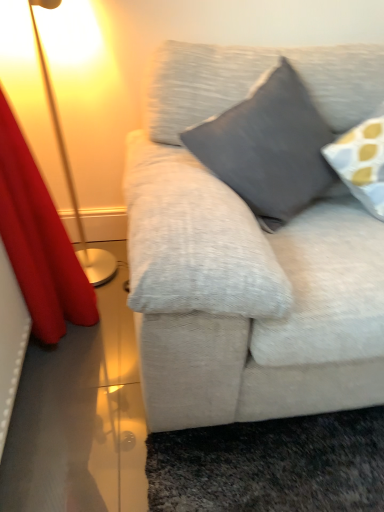
What is the approximate width of red velvet curtain at left?

The width of red velvet curtain at left is 10.45 inches.

Identify the location of dark gray fabric pillow at center. Image resolution: width=384 pixels, height=512 pixels. tap(269, 148).

What is the approximate height of dark gray fabric pillow at center?

The height of dark gray fabric pillow at center is 44.89 centimeters.

This screenshot has width=384, height=512. What do you see at coordinates (71, 172) in the screenshot?
I see `metallic gold lamp at left` at bounding box center [71, 172].

This screenshot has height=512, width=384. I want to click on red velvet curtain at left, so click(39, 241).

Based on the photo, from the image's perspective, is dark gray fabric pillow at center located above or below metallic gold lamp at left?

From the image's perspective, dark gray fabric pillow at center appears below metallic gold lamp at left.

Which is more distant, (x=262, y=118) or (x=36, y=25)?

The point (x=36, y=25) is farther from the camera.

This screenshot has height=512, width=384. In order to click on lamp on the left of dark gray fabric pillow at center in this screenshot , I will do `click(71, 172)`.

Which of these two, dark gray fabric pillow at center or metallic gold lamp at left, is smaller?

Smaller between the two is dark gray fabric pillow at center.

Between red velvet curtain at left and dark gray fabric pillow at center, which one has smaller width?

Thinner between the two is red velvet curtain at left.

Is red velvet curtain at left in front of or behind dark gray fabric pillow at center in the image?

red velvet curtain at left is in front of dark gray fabric pillow at center.

Considering the relative sizes of red velvet curtain at left and dark gray fabric pillow at center in the image provided, is red velvet curtain at left shorter than dark gray fabric pillow at center?

Incorrect, the height of red velvet curtain at left does not fall short of that of dark gray fabric pillow at center.

Does point (7, 206) appear closer or farther from the camera than point (252, 178)?

Clearly, point (7, 206) is closer to the camera than point (252, 178).

Considering the relative sizes of metallic gold lamp at left and red velvet curtain at left in the image provided, is metallic gold lamp at left shorter than red velvet curtain at left?

Correct, metallic gold lamp at left is not as tall as red velvet curtain at left.

Is metallic gold lamp at left wider than red velvet curtain at left?

Yes, metallic gold lamp at left is wider than red velvet curtain at left.

From the image's perspective, between metallic gold lamp at left and red velvet curtain at left, which one is located above?

metallic gold lamp at left is shown above in the image.

Is metallic gold lamp at left inside the boundaries of red velvet curtain at left, or outside?

metallic gold lamp at left is not inside red velvet curtain at left, it's outside.

Who is more distant, red velvet curtain at left or metallic gold lamp at left?

metallic gold lamp at left is further from the camera.

Is metallic gold lamp at left a part of red velvet curtain at left?

No, red velvet curtain at left does not contain metallic gold lamp at left.

Consider the image. Is the surface of red velvet curtain at left in direct contact with metallic gold lamp at left?

red velvet curtain at left and metallic gold lamp at left are clearly separated.

Considering the positions of points (28, 241) and (69, 192), is point (28, 241) closer to camera compared to point (69, 192)?

Yes.

Could you tell me if dark gray fabric pillow at center is turned towards red velvet curtain at left?

No, dark gray fabric pillow at center is not facing towards red velvet curtain at left.

At what (x,y) coordinates should I click in order to perform the action: click on pillow above the red velvet curtain at left (from a real-world perspective). Please return your answer as a coordinate pair (x, y). This screenshot has height=512, width=384. Looking at the image, I should click on (269, 148).

From a real-world perspective, relative to red velvet curtain at left, is dark gray fabric pillow at center vertically above or below?

From a real-world perspective, dark gray fabric pillow at center is physically above red velvet curtain at left.

Considering the sizes of metallic gold lamp at left and dark gray fabric pillow at center in the image, is metallic gold lamp at left wider or thinner than dark gray fabric pillow at center?

In the image, metallic gold lamp at left appears to be more narrow than dark gray fabric pillow at center.

Which of these two, metallic gold lamp at left or dark gray fabric pillow at center, stands shorter?

dark gray fabric pillow at center is shorter.

Is dark gray fabric pillow at center at the back of metallic gold lamp at left?

No, metallic gold lamp at left's orientation is not away from dark gray fabric pillow at center.

At what (x,y) coordinates should I click in order to perform the action: click on lamp that appears behind the dark gray fabric pillow at center. Please return your answer as a coordinate pair (x, y). Looking at the image, I should click on (71, 172).

Identify the location of pillow lying on the right of red velvet curtain at left. The width and height of the screenshot is (384, 512). (269, 148).

Based on their spatial positions, is metallic gold lamp at left or dark gray fabric pillow at center further from red velvet curtain at left?

dark gray fabric pillow at center.

Which object lies further to the anchor point metallic gold lamp at left, dark gray fabric pillow at center or red velvet curtain at left?

dark gray fabric pillow at center.

Looking at the image, which one is located closer to metallic gold lamp at left, red velvet curtain at left or dark gray fabric pillow at center?

red velvet curtain at left is closer to metallic gold lamp at left.

Looking at the image, which one is located further to red velvet curtain at left, dark gray fabric pillow at center or metallic gold lamp at left?

Based on the image, dark gray fabric pillow at center appears to be further to red velvet curtain at left.

Estimate the real-world distances between objects in this image. Which object is further from dark gray fabric pillow at center, metallic gold lamp at left or red velvet curtain at left?

metallic gold lamp at left.

Estimate the real-world distances between objects in this image. Which object is closer to dark gray fabric pillow at center, red velvet curtain at left or metallic gold lamp at left?

red velvet curtain at left is closer to dark gray fabric pillow at center.

You are a GUI agent. You are given a task and a screenshot of the screen. Output one action in this format:
    pyautogui.click(x=<x>, y=<y>)
    Task: Click on the curtain between metallic gold lamp at left and dark gray fabric pillow at center from left to right
    
    Given the screenshot: What is the action you would take?
    coord(39,241)